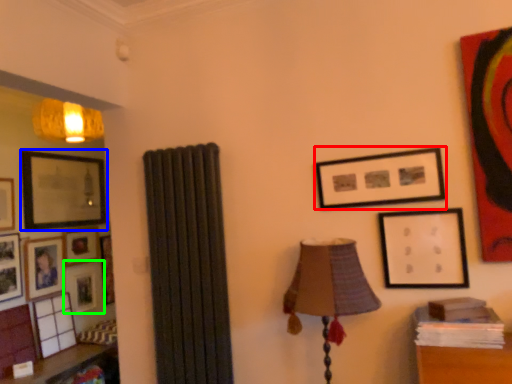
Question: Estimate the real-world distances between objects in this image. Which object is closer to picture frame (highlighted by a red box), picture frame (highlighted by a blue box) or picture frame (highlighted by a green box)?

Choices:
 (A) picture frame
 (B) picture frame

Answer: (A)